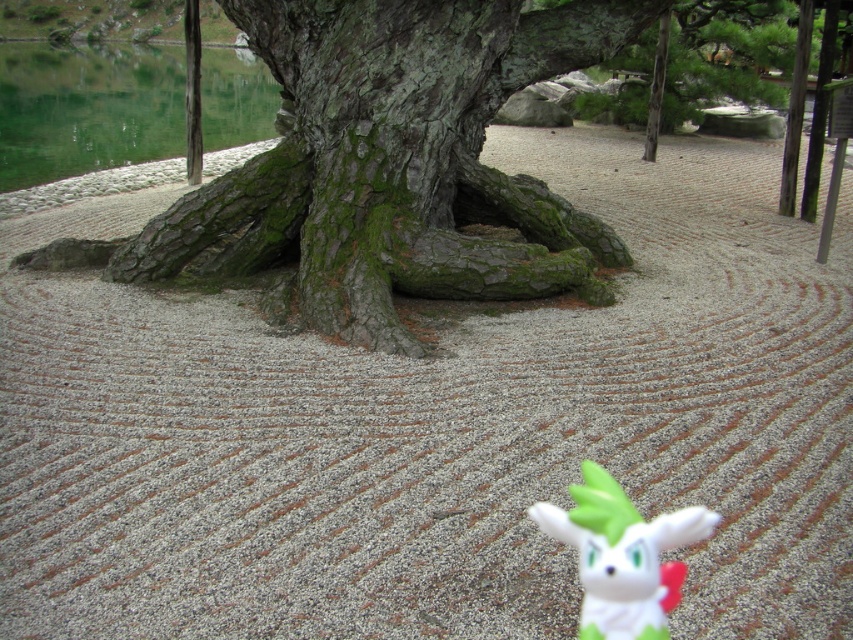
Question: Among these points, which one is farthest from the camera?

Choices:
 (A) (636, 620)
 (B) (453, 134)

Answer: (B)

Question: Among these points, which one is farthest from the camera?

Choices:
 (A) (x=679, y=580)
 (B) (x=450, y=237)

Answer: (B)

Question: Among these points, which one is farthest from the camera?

Choices:
 (A) (672, 544)
 (B) (315, 138)

Answer: (B)

Question: Is green mossy bark tree at center above white matte plush toy at lower center?

Choices:
 (A) yes
 (B) no

Answer: (A)

Question: Is green mossy bark tree at center thinner than white matte plush toy at lower center?

Choices:
 (A) yes
 (B) no

Answer: (B)

Question: Can you confirm if green mossy bark tree at center is positioned to the left of white matte plush toy at lower center?

Choices:
 (A) no
 (B) yes

Answer: (B)